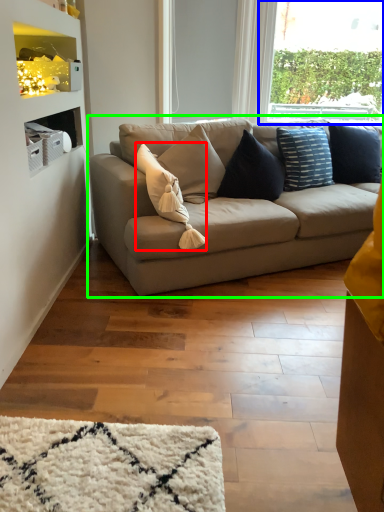
Question: Based on their relative distances, which object is nearer to pillow (highlighted by a red box)? Choose from window (highlighted by a blue box) and studio couch (highlighted by a green box).

Choices:
 (A) window
 (B) studio couch

Answer: (B)